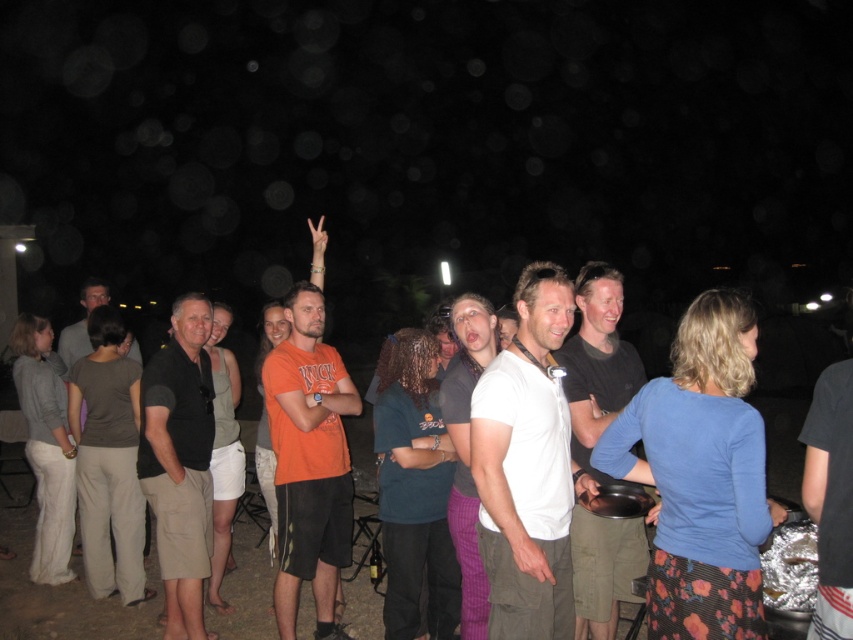
Question: Estimate the real-world distances between objects in this image. Which object is closer to the white matte t-shirt at center?

Choices:
 (A) black cotton shirt at center
 (B) orange cotton t-shirt at center

Answer: (B)

Question: In this image, where is orange cotton t-shirt at center located relative to purple plaid pants at center?

Choices:
 (A) above
 (B) below

Answer: (B)

Question: Is white matte t-shirt at center positioned before black cotton shirt at center?

Choices:
 (A) no
 (B) yes

Answer: (B)

Question: Which point is closer to the camera?

Choices:
 (A) purple plaid pants at center
 (B) orange cotton t-shirt at center
 (C) dark gray shirt at left

Answer: (A)

Question: Can you confirm if white cotton t-shirt at center is smaller than dark gray shirt at left?

Choices:
 (A) yes
 (B) no

Answer: (A)

Question: Which of the following is the closest to the observer?

Choices:
 (A) (x=80, y=296)
 (B) (x=157, y=483)
 (C) (x=465, y=628)
 (D) (x=277, y=436)

Answer: (C)